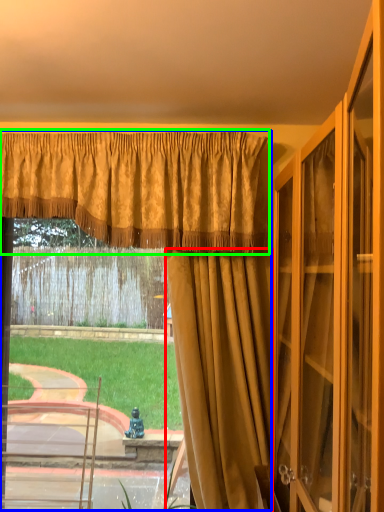
Question: Estimate the real-world distances between objects in this image. Which object is closer to curtain (highlighted by a red box), curtain (highlighted by a blue box) or curtain (highlighted by a green box)?

Choices:
 (A) curtain
 (B) curtain

Answer: (A)